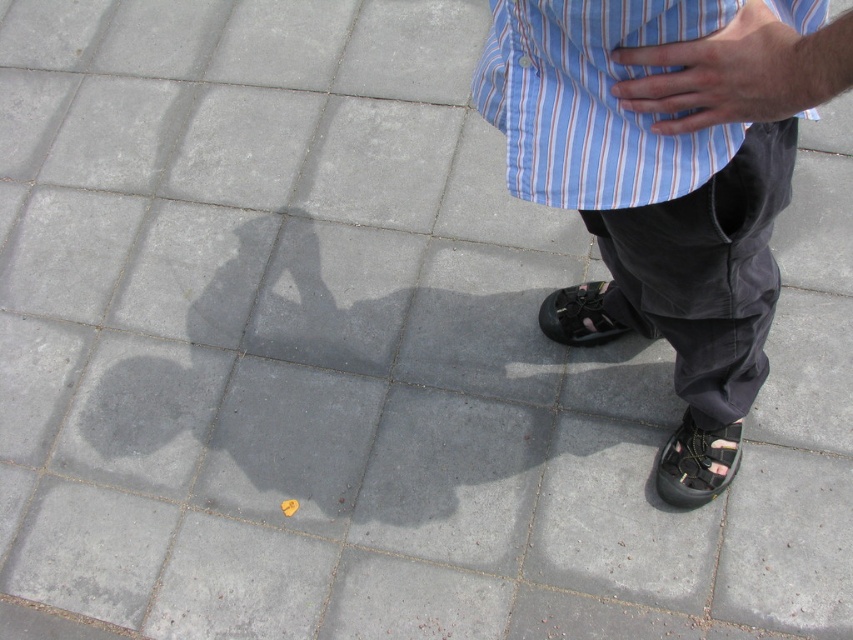
You are standing at the point labeled as point (572, 316) and want to walk towards the point labeled as point (801, 20). According to the scene, which direction should you face to move directly towards your destination?

You should face towards the direction of the shadow cast by the person, as the light source is above and to the left, making the shadow elongated and pointing towards point (801, 20) which is in front of point (572, 316).

You are a photographer setting up a shot of the person in the image. You need to ensure that the smooth skin hand at center and the black leather shoe at lower center are both in focus. Which object should you adjust the camera focus on first to ensure both are sharp?

The smooth skin hand at center has a lesser width compared to black leather shoe at lower center, so you should focus on the black leather shoe at lower center first since it is larger and will require more precise focusing to ensure sharpness throughout its entire surface area.